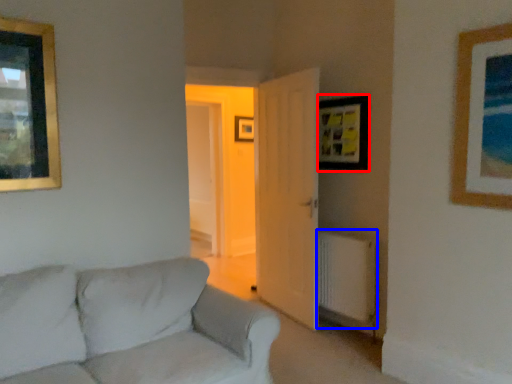
Question: Which of the following is the closest to the observer, picture frame (highlighted by a red box) or radiator (highlighted by a blue box)?

Choices:
 (A) picture frame
 (B) radiator

Answer: (B)